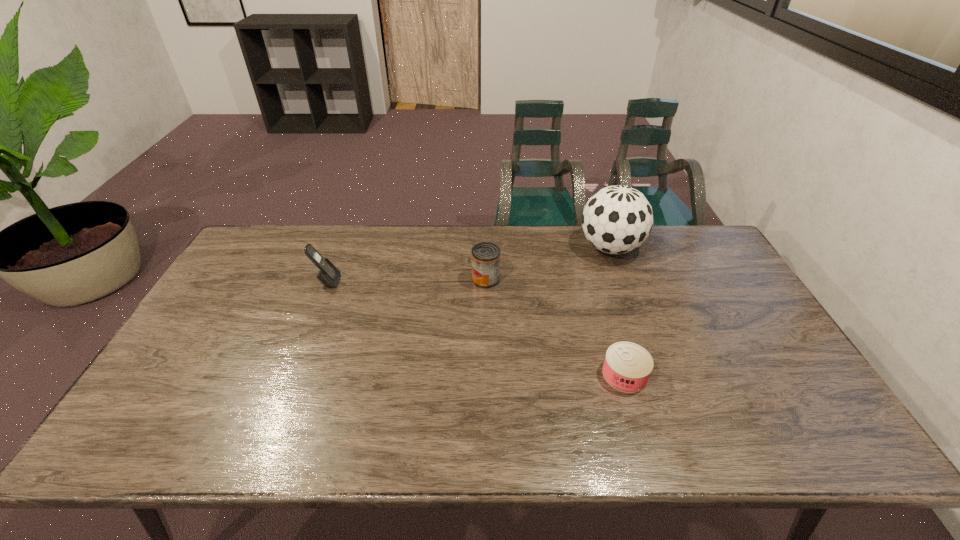
I want to click on vacant area situated on the left of the taller can, so click(374, 279).

You are a GUI agent. You are given a task and a screenshot of the screen. Output one action in this format:
    pyautogui.click(x=<x>, y=<y>)
    Task: Click on the vacant space located 0.130m on the right of the nearer can
    
    Given the screenshot: What is the action you would take?
    pyautogui.click(x=698, y=375)

Locate an element on the screen. This screenshot has height=540, width=960. object present at the far edge is located at coordinates (617, 219).

The width and height of the screenshot is (960, 540). In order to click on blank space at the far edge of the desktop in this screenshot , I will do `click(545, 244)`.

Find the location of `vacant space at the near edge of the desktop`. vacant space at the near edge of the desktop is located at coordinates (221, 434).

Where is `blank area at the left edge`? The width and height of the screenshot is (960, 540). blank area at the left edge is located at coordinates (187, 403).

Image resolution: width=960 pixels, height=540 pixels. I want to click on free spot at the far left corner of the desktop, so click(x=279, y=248).

This screenshot has height=540, width=960. Find the location of `vacant region between the nearest object and the cellular telephone`. vacant region between the nearest object and the cellular telephone is located at coordinates (476, 328).

The width and height of the screenshot is (960, 540). I want to click on free spot between the nearer can and the tallest object, so click(617, 311).

You are a GUI agent. You are given a task and a screenshot of the screen. Output one action in this format:
    pyautogui.click(x=<x>, y=<y>)
    Task: Click on the free area in between the leftmost object and the soccer ball
    Image resolution: width=960 pixels, height=540 pixels.
    Given the screenshot: What is the action you would take?
    pyautogui.click(x=468, y=265)